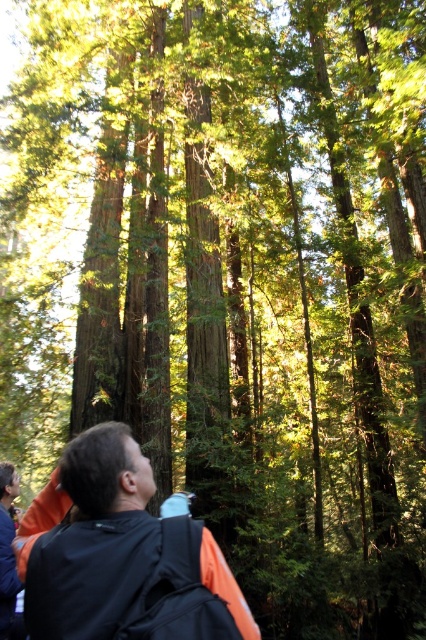
You are a hiker who wants to know if your orange fabric backpack at lower center can fit into the storage compartment of your orange fabric jacket at lower left. Based on the scene, can it fit?

The orange fabric backpack at lower center has a smaller size compared to orange fabric jacket at lower left, so it can fit into the storage compartment of the jacket.

You are a hiker in the forest and want to check your backpack. Which direction should you turn to face your orange fabric backpack at lower center from your orange fabric jacket at lower left?

The orange fabric backpack at lower center is positioned on the right side of the orange fabric jacket at lower left. Therefore, you should turn to your right to face the orange fabric backpack at lower center.

You are a hiker who wants to know if your orange fabric backpack at lower center will fit into the compartment of your orange fabric jacket at lower left. Based on their sizes, can you determine if the backpack will fit into the jacket compartment?

The orange fabric backpack at lower center is wider than the orange fabric jacket at lower left, so the backpack cannot fit into the jacket compartment.